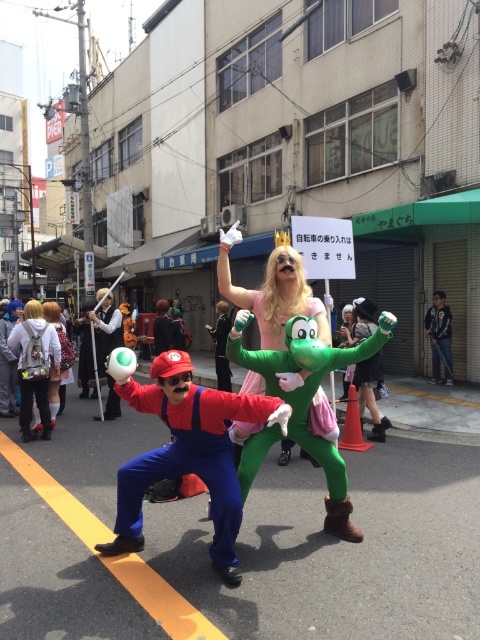
You are a photographer at the event and want to capture both the shiny silver sword at center and the green rubber gloves at center in a single frame. Which object should you position closer to the left side of your camera viewfinder to ensure both are visible?

To ensure both the shiny silver sword at center and the green rubber gloves at center are visible, position the shiny silver sword at center closer to the left side of your camera viewfinder since it is already located to the left of the green rubber gloves at center.

From the picture: You are a photographer trying to capture a photo of the white plush backpack at center and the green rubber boots at center. Since they are both at the center, how can you ensure both items are in focus in your shot?

The white plush backpack at center is positioned under the green rubber boots at center, so you can focus on the green rubber boots at center first as they are closer, and the backpack will still be in focus due to its position underneath.